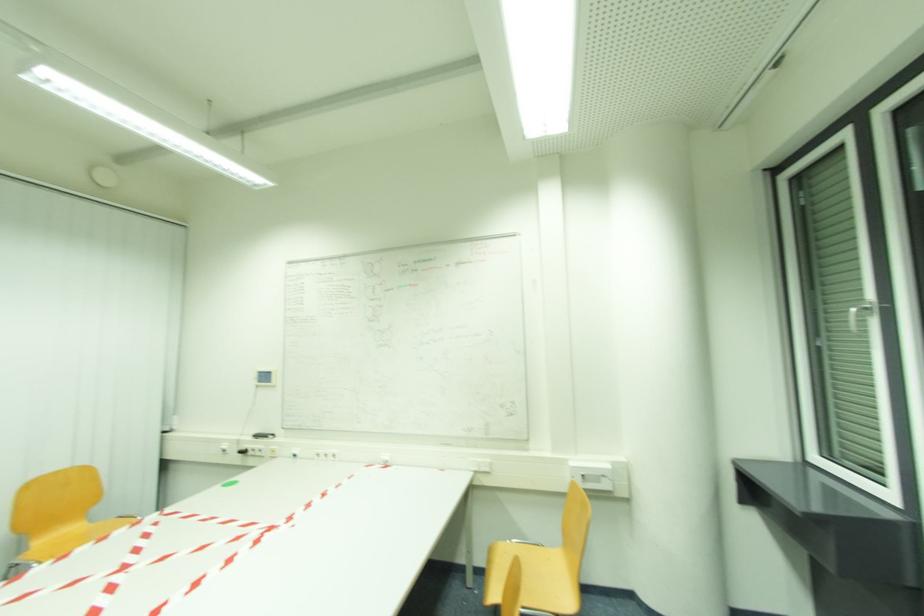
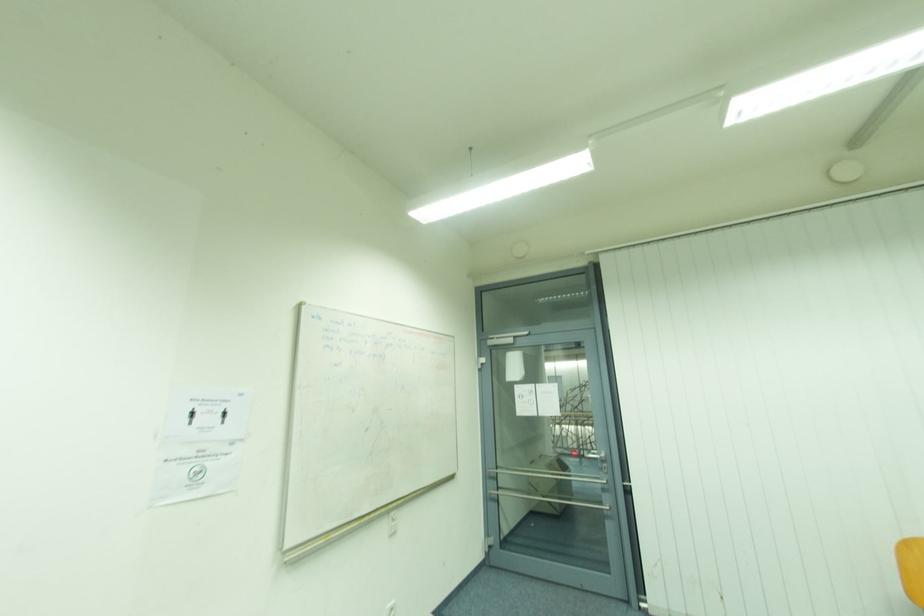
Question: The camera is either moving clockwise (left) or counter-clockwise (right) around the object. The first image is from the beginning of the video and the second image is from the end. Is the camera moving left or right when shooting the video?

Choices:
 (A) Left
 (B) Right

Answer: (B)